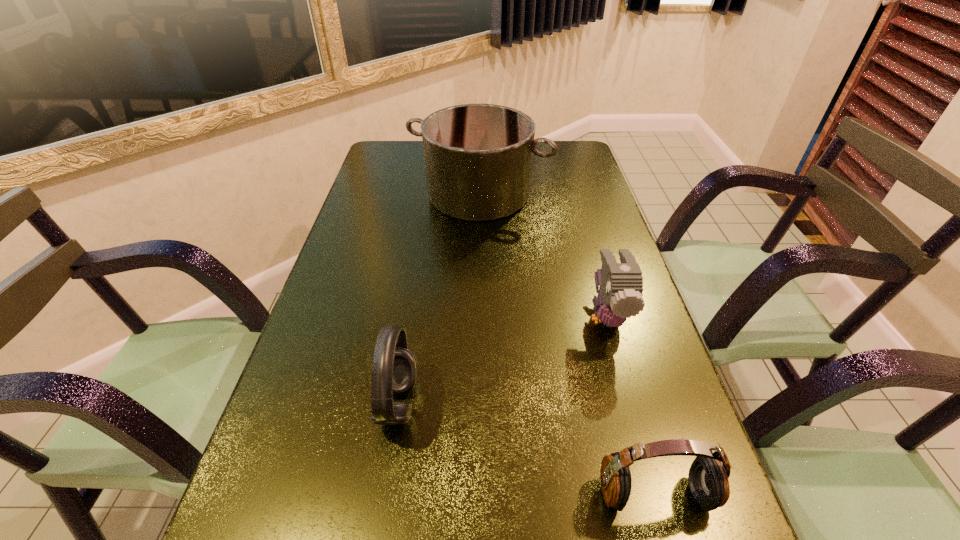
The image size is (960, 540). In order to click on object that is positioned at the far edge in this screenshot , I will do `click(478, 157)`.

Identify the location of object at the left edge. pos(478,157).

Locate an element on the screen. The image size is (960, 540). pan that is at the right edge is located at coordinates (478, 157).

Identify the location of bird positioned at the right edge. (619, 297).

Where is `headset present at the right edge`? This screenshot has height=540, width=960. headset present at the right edge is located at coordinates (708, 475).

Locate an element on the screen. object that is at the far left corner is located at coordinates (478, 157).

Where is `object situated at the far right corner`? The width and height of the screenshot is (960, 540). object situated at the far right corner is located at coordinates (478, 157).

This screenshot has width=960, height=540. In the image, there is a desktop. Identify the location of vacant space at the left edge. (289, 429).

Find the location of a particular element. free space at the right edge of the desktop is located at coordinates (647, 318).

The width and height of the screenshot is (960, 540). Find the location of `vacant region at the far left corner of the desktop`. vacant region at the far left corner of the desktop is located at coordinates (378, 171).